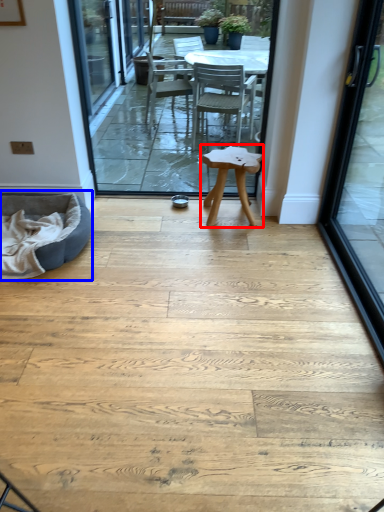
Question: Which object appears closest to the camera in this image, stool (highlighted by a red box) or bean bag chair (highlighted by a blue box)?

Choices:
 (A) stool
 (B) bean bag chair

Answer: (B)